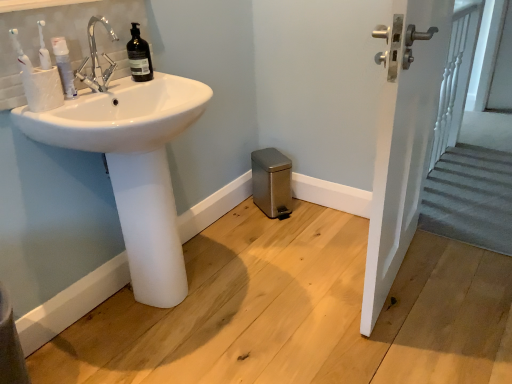
Identify the location of vacant area that is situated to the right of white glossy sink at left. The width and height of the screenshot is (512, 384). (280, 292).